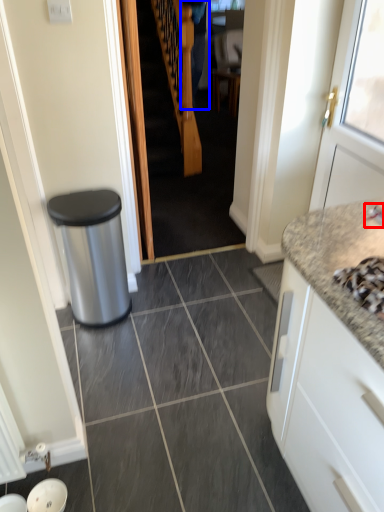
Question: Which of the following is the farthest to the observer, faucet (highlighted by a red box) or couple (highlighted by a blue box)?

Choices:
 (A) faucet
 (B) couple

Answer: (B)